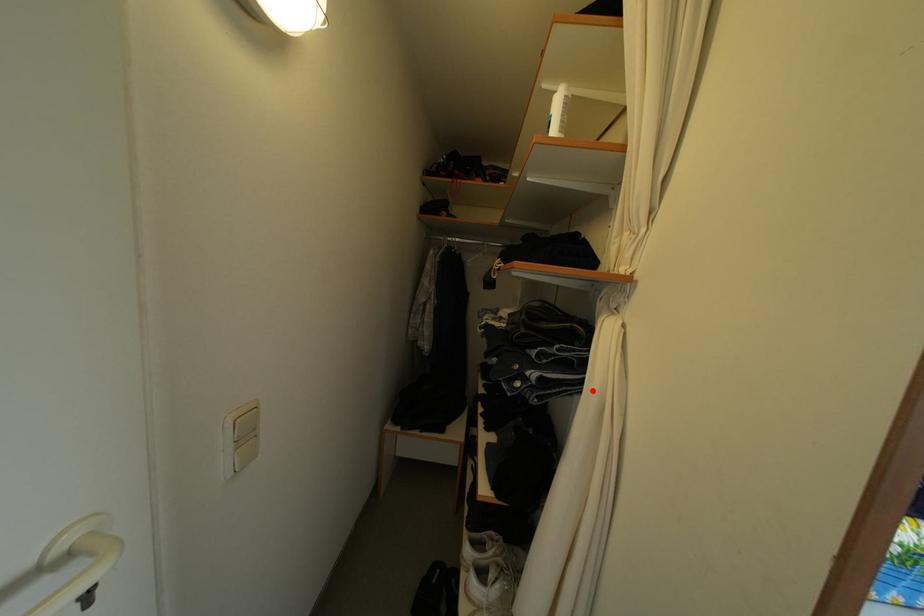
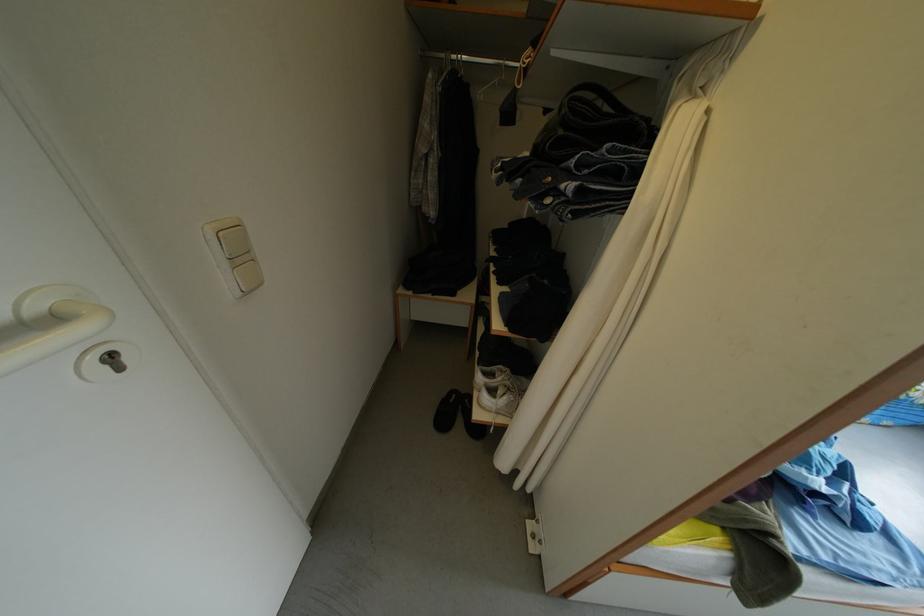
Question: I am providing you with two images of the same scene from different viewpoints. A red point is marked on the first image. At the location where the point appears in image 1, is it still visible in image 2?

Choices:
 (A) Yes
 (B) No

Answer: (A)